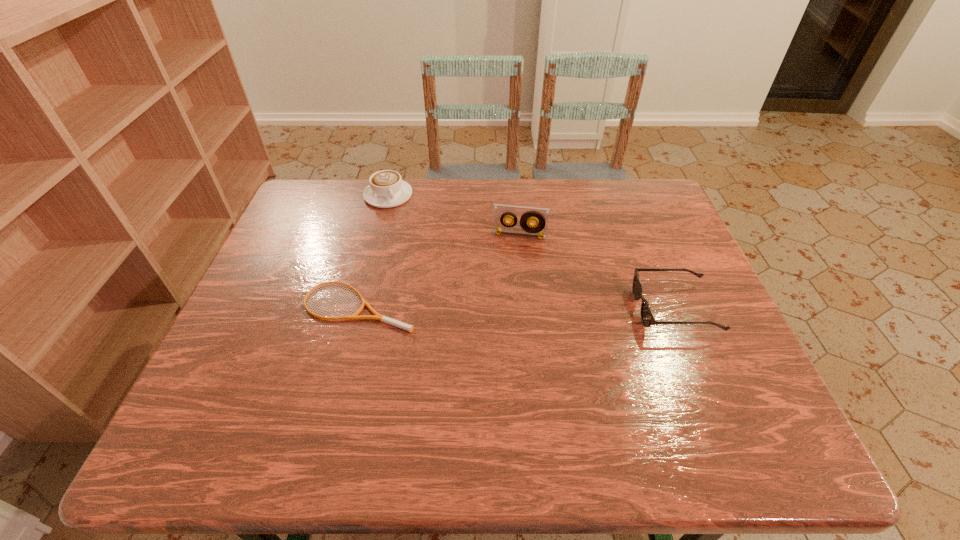
I want to click on tennis racket, so click(382, 318).

Locate an element on the screen. Image resolution: width=960 pixels, height=540 pixels. the rightmost object is located at coordinates point(647,317).

This screenshot has height=540, width=960. What are the coordinates of `the second farthest object` in the screenshot? It's located at [540, 216].

Identify the location of the tallest object. The width and height of the screenshot is (960, 540). (540, 216).

Identify the location of cappuccino. (387, 189).

Locate an element on the screen. This screenshot has height=540, width=960. vacant space situated 0.380m on the back of the tennis racket is located at coordinates (387, 194).

At what (x,y) coordinates should I click in order to perform the action: click on vacant position located 0.220m on the front lenses of the sunglasses. Please return your answer as a coordinate pair (x, y). This screenshot has width=960, height=540. Looking at the image, I should click on tap(545, 309).

Identify the location of vacant space located on the front lenses of the sunglasses. Image resolution: width=960 pixels, height=540 pixels. (478, 309).

The width and height of the screenshot is (960, 540). What are the coordinates of `free region located on the front lenses of the sunglasses` in the screenshot? It's located at (612, 309).

What are the coordinates of `vacant space located at the front of the third object from left to right with visible reels` in the screenshot? It's located at (513, 259).